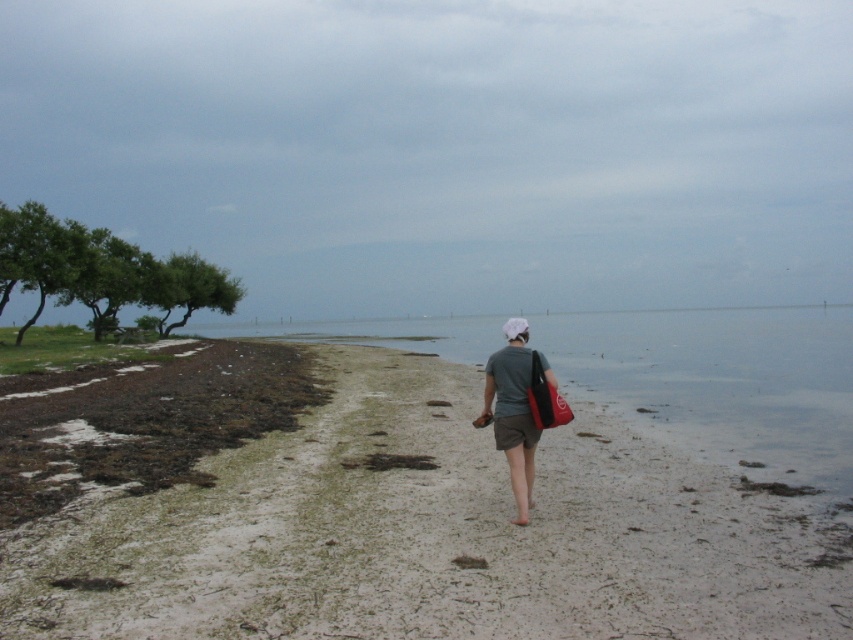
Question: Is green leafy trees at left closer to the viewer compared to green leafy tree at left?

Choices:
 (A) no
 (B) yes

Answer: (B)

Question: Is clear water at lower left smaller than gray fabric bag at center?

Choices:
 (A) no
 (B) yes

Answer: (A)

Question: Which object is positioned closest to the gray fabric bag at center?

Choices:
 (A) green leafy tree at left
 (B) white sandy beach at center
 (C) clear water at lower left

Answer: (B)

Question: Considering the relative positions of white sandy beach at center and green leafy trees at left in the image provided, where is white sandy beach at center located with respect to green leafy trees at left?

Choices:
 (A) above
 (B) below

Answer: (B)

Question: Which point appears farthest from the camera in this image?

Choices:
 (A) (746, 324)
 (B) (103, 314)

Answer: (A)

Question: Among these points, which one is farthest from the camera?

Choices:
 (A) (7, 243)
 (B) (149, 304)

Answer: (B)